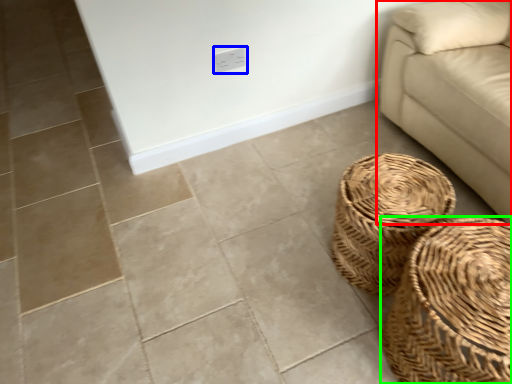
Question: Based on their relative distances, which object is nearer to studio couch (highlighted by a red box)? Choose from electric outlet (highlighted by a blue box) and basket (highlighted by a green box).

Choices:
 (A) electric outlet
 (B) basket

Answer: (B)